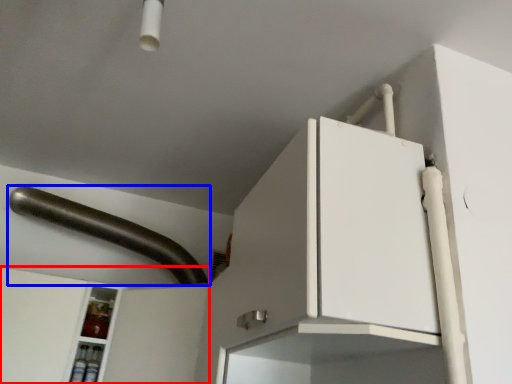
Question: Which object is closer to the camera taking this photo, cabinetry (highlighted by a red box) or door handle (highlighted by a blue box)?

Choices:
 (A) cabinetry
 (B) door handle

Answer: (A)